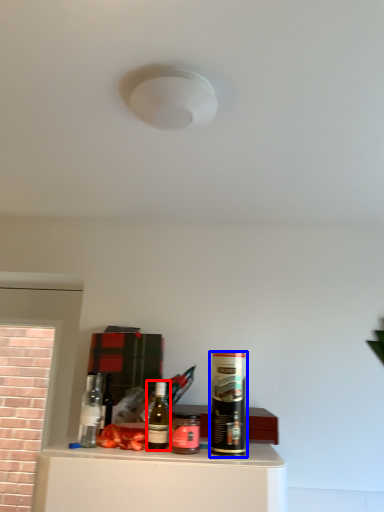
Question: Among these objects, which one is farthest to the camera, bottle (highlighted by a red box) or beverage (highlighted by a blue box)?

Choices:
 (A) bottle
 (B) beverage

Answer: (A)